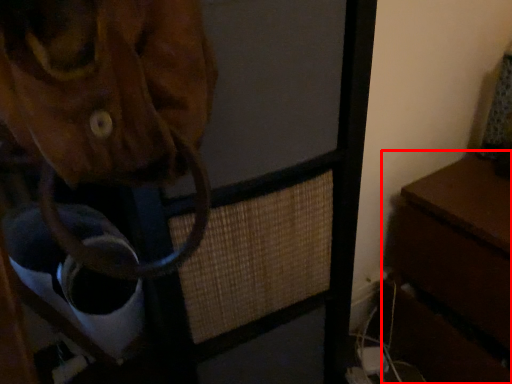
Question: Considering the relative positions of table (annotated by the red box) and furniture in the image provided, where is table (annotated by the red box) located with respect to the staircase?

Choices:
 (A) right
 (B) left

Answer: (A)